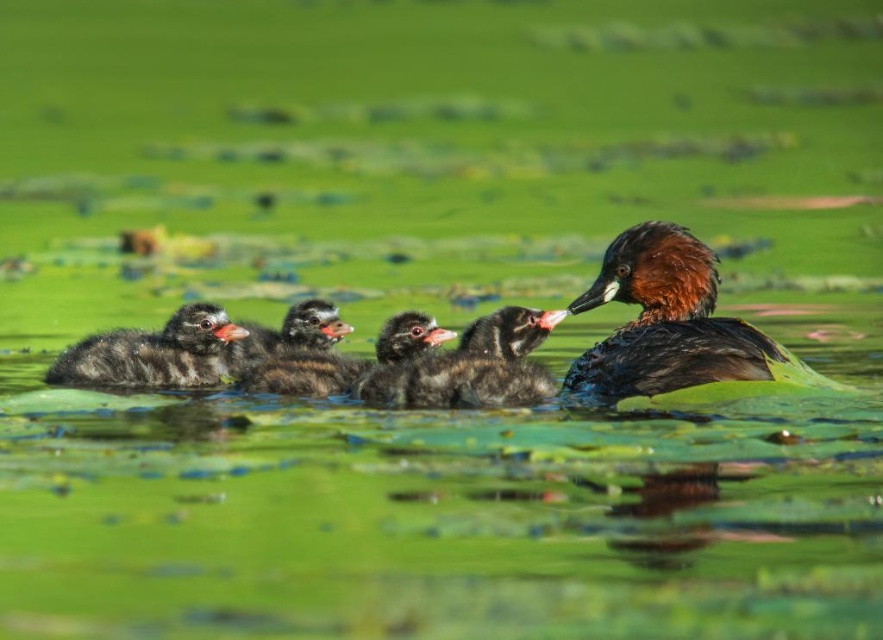
Does dark brown fluffy ducklings at center lie behind black fluffy duckling at center?

Yes, it is behind black fluffy duckling at center.

Between point (268, 348) and point (391, 337), which one is positioned in front?

Positioned in front is point (391, 337).

Find the location of `dark brown fluffy ducklings at center`. dark brown fluffy ducklings at center is located at coordinates (299, 353).

Based on the photo, who is positioned more to the right, brown glossy duck at center or dark gray fluffy duckling at left?

From the viewer's perspective, brown glossy duck at center appears more on the right side.

Can you confirm if brown glossy duck at center is taller than dark gray fluffy duckling at left?

Indeed, brown glossy duck at center has a greater height compared to dark gray fluffy duckling at left.

The image size is (883, 640). I want to click on brown glossy duck at center, so click(x=670, y=323).

Between dark gray fluffy duckling at left and dark brown fluffy ducklings at center, which one appears on the left side from the viewer's perspective?

dark gray fluffy duckling at left

Which is behind, point (147, 333) or point (298, 353)?

Point (147, 333)

The width and height of the screenshot is (883, 640). Find the location of `dark gray fluffy duckling at left`. dark gray fluffy duckling at left is located at coordinates (155, 353).